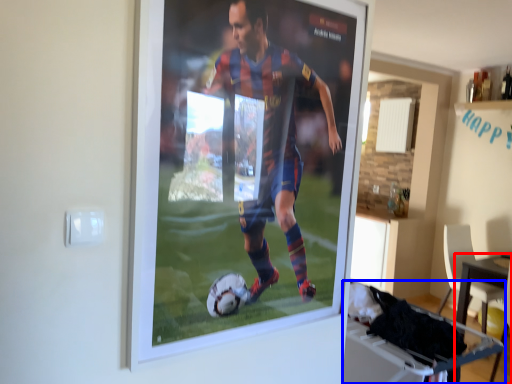
Question: Which point is further to the camera, table (highlighted by a red box) or table (highlighted by a blue box)?

Choices:
 (A) table
 (B) table

Answer: (A)